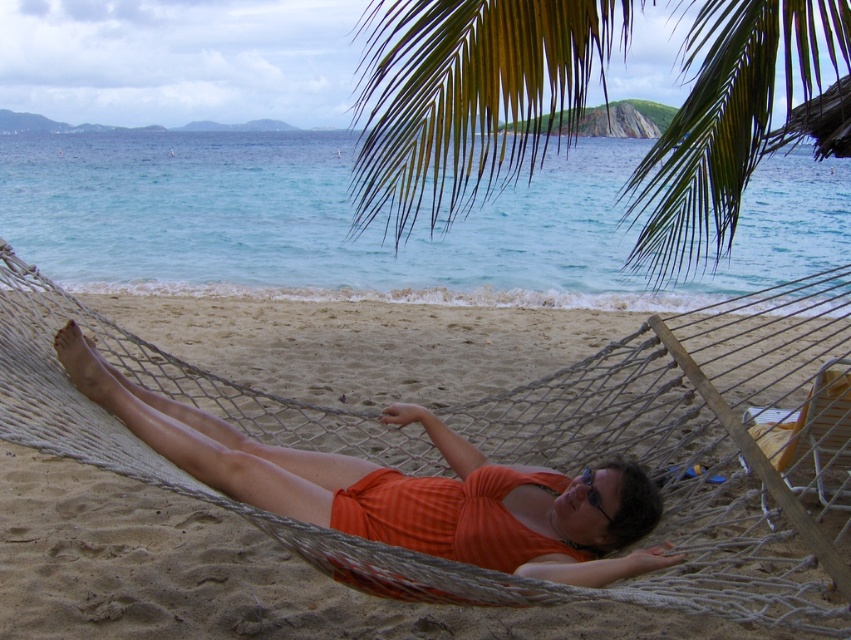
Can you confirm if green leafy palm tree at upper center is thinner than orange fabric hammock at center?

No, green leafy palm tree at upper center is not thinner than orange fabric hammock at center.

Is the position of green leafy palm tree at upper center more distant than that of orange fabric hammock at center?

That is False.

Find the location of a particular element. This screenshot has height=640, width=851. green leafy palm tree at upper center is located at coordinates (470, 96).

Who is positioned more to the left, orange fabric hammock at center or transparent plastic goggles at center?

Positioned to the left is orange fabric hammock at center.

Can you confirm if orange fabric hammock at center is bigger than transparent plastic goggles at center?

Indeed, orange fabric hammock at center has a larger size compared to transparent plastic goggles at center.

Between point (404, 520) and point (607, 516), which one is positioned in front?

Positioned in front is point (607, 516).

Where is `orange fabric hammock at center`? This screenshot has width=851, height=640. orange fabric hammock at center is located at coordinates (398, 486).

Is green leafy palm tree at upper center positioned at the back of transparent plastic goggles at center?

No, green leafy palm tree at upper center is in front of transparent plastic goggles at center.

Is point (612, 32) positioned before point (586, 476)?

No, (612, 32) is further to viewer.

Where is `green leafy palm tree at upper center`? green leafy palm tree at upper center is located at coordinates click(x=470, y=96).